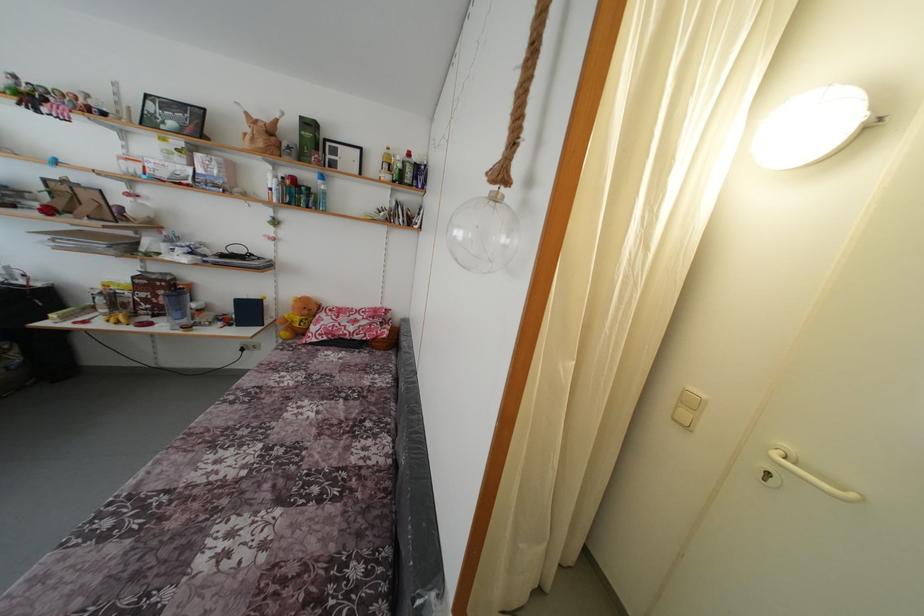
The width and height of the screenshot is (924, 616). What do you see at coordinates (349, 323) in the screenshot?
I see `the patterned pillow` at bounding box center [349, 323].